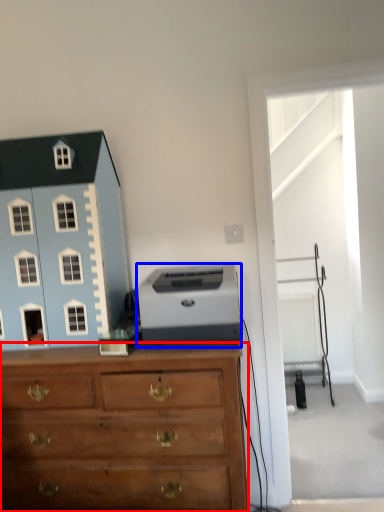
Question: Which object appears farthest to the camera in this image, chest of drawers (highlighted by a red box) or printer (highlighted by a blue box)?

Choices:
 (A) chest of drawers
 (B) printer

Answer: (B)